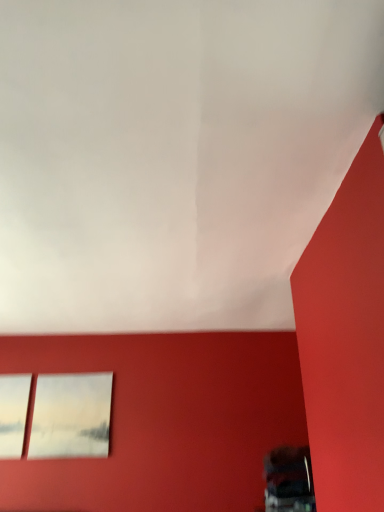
Question: Should I look upward or downward to see transparent glass window at lower left?

Choices:
 (A) up
 (B) down

Answer: (B)

Question: Should I look upward or downward to see matte white picture frame at upper left?

Choices:
 (A) up
 (B) down

Answer: (B)

Question: From a real-world perspective, is matte white picture frame at upper left on top of transparent glass window at lower left?

Choices:
 (A) yes
 (B) no

Answer: (B)

Question: Is transparent glass window at lower left located within matte white picture frame at upper left?

Choices:
 (A) no
 (B) yes

Answer: (A)

Question: From the image's perspective, does matte white picture frame at upper left appear higher than transparent glass window at lower left?

Choices:
 (A) no
 (B) yes

Answer: (A)

Question: Is matte white picture frame at upper left positioned in front of transparent glass window at lower left?

Choices:
 (A) no
 (B) yes

Answer: (A)

Question: Can you confirm if matte white picture frame at upper left is smaller than transparent glass window at lower left?

Choices:
 (A) yes
 (B) no

Answer: (B)

Question: Is matte white picture frame at upper left next to transparent glass window at lower left?

Choices:
 (A) yes
 (B) no

Answer: (B)

Question: Is transparent glass window at lower left facing towards matte white picture frame at upper left?

Choices:
 (A) yes
 (B) no

Answer: (B)

Question: Is transparent glass window at lower left to the left of matte white picture frame at upper left from the viewer's perspective?

Choices:
 (A) yes
 (B) no

Answer: (A)

Question: From a real-world perspective, does transparent glass window at lower left stand above matte white picture frame at upper left?

Choices:
 (A) no
 (B) yes

Answer: (B)

Question: Is transparent glass window at lower left bigger than matte white picture frame at upper left?

Choices:
 (A) yes
 (B) no

Answer: (B)

Question: From the image's perspective, is transparent glass window at lower left located beneath matte white picture frame at upper left?

Choices:
 (A) yes
 (B) no

Answer: (B)

Question: Are transparent glass window at lower left and matte white picture frame at upper left far apart?

Choices:
 (A) no
 (B) yes

Answer: (A)

Question: In terms of width, does transparent glass window at lower left look wider or thinner when compared to matte white picture frame at upper left?

Choices:
 (A) thin
 (B) wide

Answer: (B)